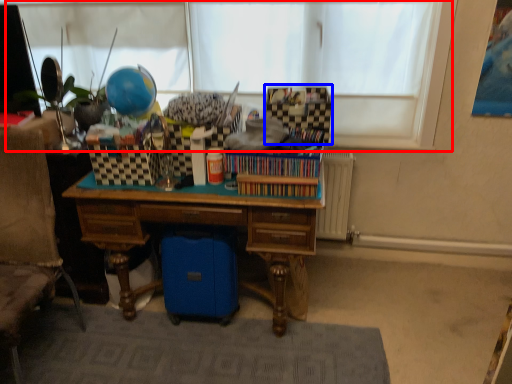
Question: Which of the following is the farthest to the observer, window screen (highlighted by a red box) or storage box (highlighted by a blue box)?

Choices:
 (A) window screen
 (B) storage box

Answer: (A)